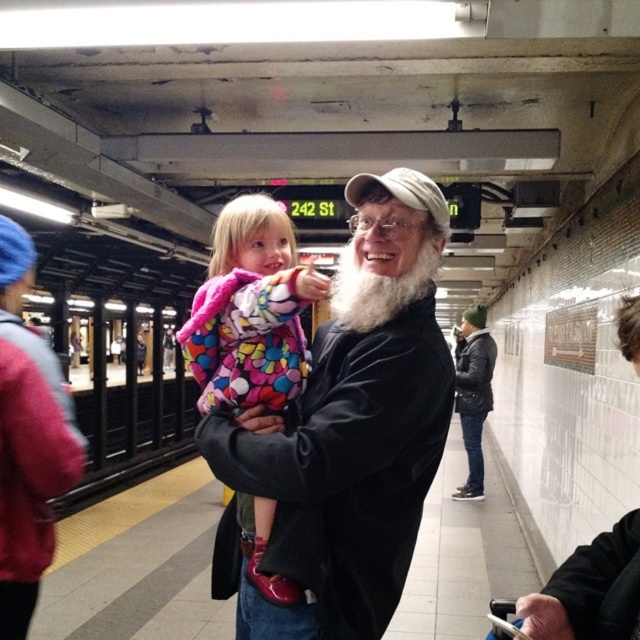
Does fluffy pink coat at center have a greater height compared to white matte santa claus at right?

Yes.

Which of these two, fluffy pink coat at center or white matte santa claus at right, stands shorter?

white matte santa claus at right is shorter.

You are a GUI agent. You are given a task and a screenshot of the screen. Output one action in this format:
    pyautogui.click(x=<x>, y=<y>)
    Task: Click on the fluffy pink coat at center
    The width and height of the screenshot is (640, 640).
    Given the screenshot: What is the action you would take?
    pyautogui.click(x=250, y=310)

Where is `fluffy pink coat at center`? This screenshot has width=640, height=640. fluffy pink coat at center is located at coordinates (250, 310).

At what (x,y) coordinates should I click in order to perform the action: click on fluffy pink coat at center. Please return your answer as a coordinate pair (x, y). Looking at the image, I should click on (250, 310).

Who is positioned more to the left, fluffy pink coat at center or whitewoollybeard at center?

From the viewer's perspective, fluffy pink coat at center appears more on the left side.

Between point (321, 282) and point (342, 292), which one is positioned in front?

Point (321, 282)

Identify the location of fluffy pink coat at center. Image resolution: width=640 pixels, height=640 pixels. (250, 310).

Is point (397, 564) in front of point (404, 301)?

No, it is not.

Can you confirm if white matte beard at center is positioned to the right of whitewoollybeard at center?

In fact, white matte beard at center is to the left of whitewoollybeard at center.

Who is more forward, (230, 451) or (358, 316)?

Point (230, 451)

You are a GUI agent. You are given a task and a screenshot of the screen. Output one action in this format:
    pyautogui.click(x=<x>, y=<y>)
    Task: Click on the white matte beard at center
    The height and width of the screenshot is (640, 640).
    Given the screenshot: What is the action you would take?
    pyautogui.click(x=348, y=432)